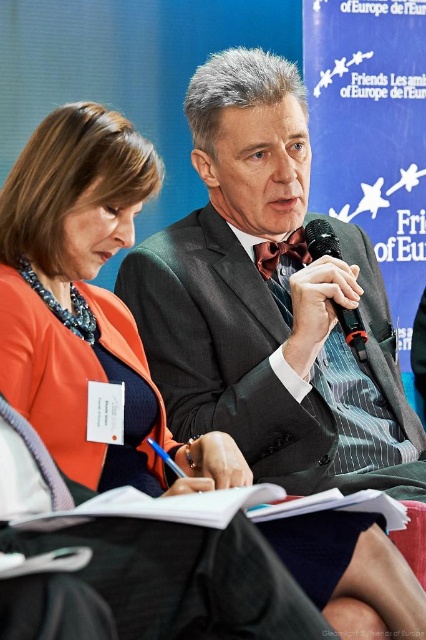
Question: Does dark gray suit at center appear over black plastic microphone at center?

Choices:
 (A) no
 (B) yes

Answer: (A)

Question: Which object is closer to the camera taking this photo?

Choices:
 (A) dark gray suit at center
 (B) black plastic microphone at center

Answer: (A)

Question: Is dark gray suit at center behind black plastic microphone at center?

Choices:
 (A) no
 (B) yes

Answer: (A)

Question: Which point is farther from the camera taking this photo?

Choices:
 (A) (337, 452)
 (B) (307, 230)

Answer: (B)

Question: Can you confirm if dark gray suit at center is positioned to the left of black plastic microphone at center?

Choices:
 (A) no
 (B) yes

Answer: (B)

Question: Among these objects, which one is farthest from the camera?

Choices:
 (A) dark gray suit at center
 (B) black plastic microphone at center

Answer: (B)